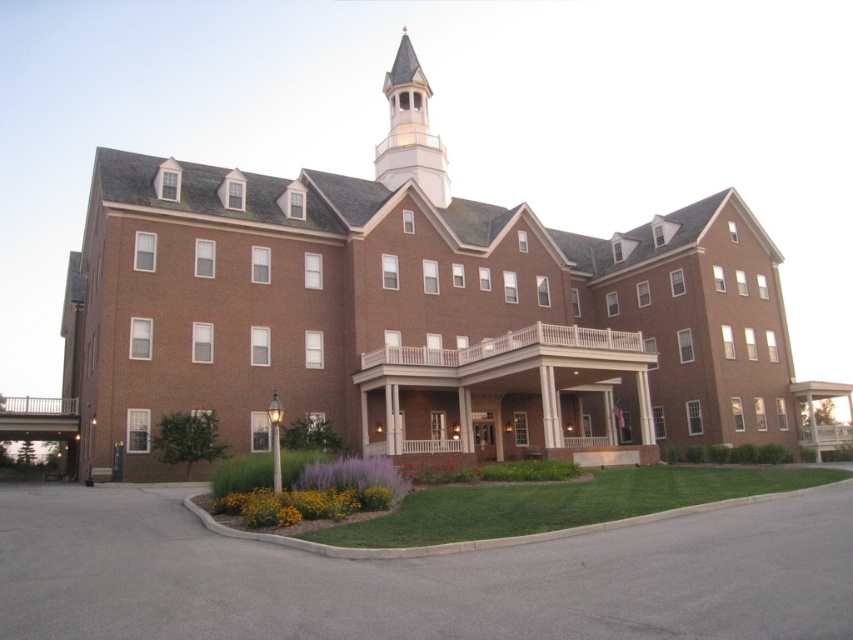
You are a delivery driver approaching the building and need to park your vehicle on the gray asphalt driveway at lower center. You notice the white wood spire at upper center above the driveway. Will the spire obstruct the view of the driveway entrance when you arrive?

The gray asphalt driveway at lower center has a lesser height compared to the white wood spire at upper center, so the spire will not obstruct the view of the driveway entrance since it is taller and positioned above.

You are a maintenance worker who needs to reach the white wood spire at upper center from the orange textured flowers at lower center. The ladder you have can extend up to 120 feet. Is the ladder long enough to reach the spire from the flowers?

The distance between the white wood spire at upper center and orange textured flowers at lower center is 131.24 feet, which is longer than the ladder can extend. The ladder is only 120 feet, so it is not long enough to reach the spire from the flowers.